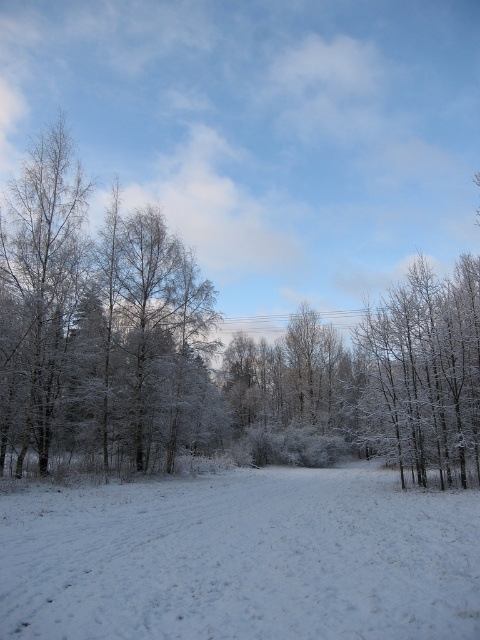
Is white frosty trees at right above white frosty tree at left?

No.

Can you confirm if white frosty trees at right is bigger than white frosty tree at left?

Yes.

What do you see at coordinates (423, 372) in the screenshot? Image resolution: width=480 pixels, height=640 pixels. I see `white frosty trees at right` at bounding box center [423, 372].

The width and height of the screenshot is (480, 640). I want to click on white frosty trees at right, so click(423, 372).

Does white fluffy snow at center appear under white frosty tree at left?

Correct, white fluffy snow at center is located below white frosty tree at left.

Which is below, white fluffy snow at center or white frosty tree at left?

white fluffy snow at center is below.

Which is in front, point (476, 552) or point (57, 150)?

Point (476, 552)

The image size is (480, 640). Identify the location of white fluffy snow at center. (240, 557).

Between point (403, 604) and point (456, 358), which one is positioned in front?

Point (403, 604) is in front.

Find the location of a particular element. Image resolution: width=480 pixels, height=640 pixels. white fluffy snow at center is located at coordinates (240, 557).